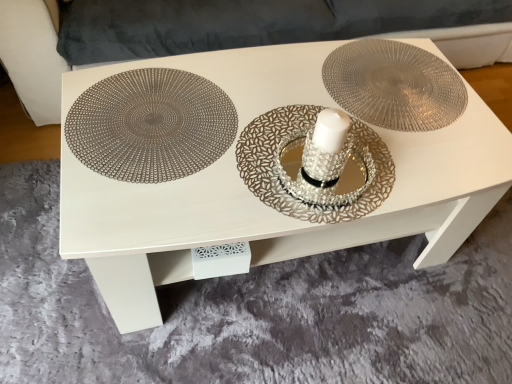
Measure the distance between point [234,228] and camera.

Point [234,228] and camera are 33.90 inches apart.

What is the approximate height of metallic placemat at center?

47.10 centimeters.

Find the location of a particular element. metallic textured saucer at center is located at coordinates (394, 85).

Image resolution: width=512 pixels, height=384 pixels. Describe the element at coordinates (394, 85) in the screenshot. I see `metallic textured saucer at center` at that location.

What do you see at coordinates (313, 165) in the screenshot? I see `silver textured plate at center` at bounding box center [313, 165].

Find the location of `suede-like gray couch at upper center`. suede-like gray couch at upper center is located at coordinates (32, 57).

Is suede-like gray couch at upper center facing away from metallic woven placemat at left?

No, suede-like gray couch at upper center is not facing the opposite direction of metallic woven placemat at left.

Considering the positions of objects suede-like gray couch at upper center and metallic woven placemat at left in the image provided, who is more to the right, suede-like gray couch at upper center or metallic woven placemat at left?

suede-like gray couch at upper center is more to the right.

From the image's perspective, which one is positioned lower, suede-like gray couch at upper center or metallic woven placemat at left?

From the image's view, metallic woven placemat at left is below.

Which is further, (47,82) or (230,144)?

Positioned behind is point (47,82).

From the image's perspective, is metallic textured saucer at center under suede-like gray couch at upper center?

Indeed, from the image's perspective, metallic textured saucer at center is shown beneath suede-like gray couch at upper center.

Is metallic textured saucer at center outside of suede-like gray couch at upper center?

metallic textured saucer at center is positioned outside suede-like gray couch at upper center.

From a real-world perspective, is metallic textured saucer at center beneath suede-like gray couch at upper center?

No, from a real-world perspective, metallic textured saucer at center is not beneath suede-like gray couch at upper center.

Where is `saucer above the suede-like gray couch at upper center (from a real-world perspective)`? The image size is (512, 384). saucer above the suede-like gray couch at upper center (from a real-world perspective) is located at coordinates (394, 85).

Considering the relative sizes of metallic textured saucer at center and metallic woven placemat at left in the image provided, is metallic textured saucer at center wider than metallic woven placemat at left?

No.

The width and height of the screenshot is (512, 384). There is a metallic woven placemat at left. What are the coordinates of `saucer above it (from a real-world perspective)` in the screenshot? It's located at (394, 85).

From the image's perspective, does metallic textured saucer at center appear higher than metallic woven placemat at left?

Yes, from the image's perspective, metallic textured saucer at center is over metallic woven placemat at left.

Could you tell me if silver textured plate at center is turned towards metallic woven placemat at left?

No, silver textured plate at center is not oriented towards metallic woven placemat at left.

Considering the points (324, 207) and (166, 81), which point is in front, point (324, 207) or point (166, 81)?

Point (324, 207)

Measure the distance from silver textured plate at center to metallic woven placemat at left.

silver textured plate at center and metallic woven placemat at left are 8.67 inches apart from each other.

Considering the relative sizes of silver textured plate at center and metallic woven placemat at left in the image provided, is silver textured plate at center smaller than metallic woven placemat at left?

Indeed, silver textured plate at center has a smaller size compared to metallic woven placemat at left.

Could you tell me if metallic woven placemat at left is turned towards metallic placemat at center?

Yes.

Is metallic woven placemat at left not inside metallic placemat at center?

Actually, metallic woven placemat at left is at least partially inside metallic placemat at center.

Looking at their sizes, would you say metallic woven placemat at left is wider or thinner than metallic placemat at center?

metallic woven placemat at left is thinner than metallic placemat at center.

The image size is (512, 384). I want to click on plate below the suede-like gray couch at upper center (from the image's perspective), so click(x=313, y=165).

Are suede-like gray couch at upper center and silver textured plate at center far apart?

Yes, suede-like gray couch at upper center and silver textured plate at center are located far from each other.

From the image's perspective, which is above, suede-like gray couch at upper center or silver textured plate at center?

suede-like gray couch at upper center.

Is the position of metallic placemat at center more distant than that of suede-like gray couch at upper center?

No, metallic placemat at center is closer to the camera.

Is point (173, 257) positioned after point (44, 43)?

That is False.

I want to click on table that appears on the left of suede-like gray couch at upper center, so click(255, 197).

Looking at this image, considering the relative sizes of metallic placemat at center and suede-like gray couch at upper center in the image provided, is metallic placemat at center shorter than suede-like gray couch at upper center?

Yes, metallic placemat at center is shorter than suede-like gray couch at upper center.

At what (x,y) coordinates should I click in order to perform the action: click on place mat located on the left of suede-like gray couch at upper center. Please return your answer as a coordinate pair (x, y). This screenshot has height=384, width=512. Looking at the image, I should click on (151, 125).

Identify the location of saucer lying in front of the suede-like gray couch at upper center. (394, 85).

When comparing their distances from metallic textured saucer at center, does suede-like gray couch at upper center or silver textured plate at center seem further?

suede-like gray couch at upper center is positioned further to the anchor metallic textured saucer at center.

Considering their positions, is suede-like gray couch at upper center positioned closer to metallic woven placemat at left than metallic placemat at center?

Based on the image, metallic placemat at center appears to be nearer to metallic woven placemat at left.

Based on their spatial positions, is metallic woven placemat at left or metallic textured saucer at center further from metallic placemat at center?

metallic textured saucer at center lies further to metallic placemat at center than the other object.

When comparing their distances from metallic woven placemat at left, does silver textured plate at center or suede-like gray couch at upper center seem further?

suede-like gray couch at upper center.

From the image, which object appears to be nearer to metallic textured saucer at center, metallic placemat at center or metallic woven placemat at left?

metallic placemat at center is closer to metallic textured saucer at center.

Looking at this image, looking at the image, which one is located further to silver textured plate at center, metallic textured saucer at center or metallic woven placemat at left?

The object further to silver textured plate at center is metallic textured saucer at center.

Looking at the image, which one is located further to metallic placemat at center, metallic woven placemat at left or suede-like gray couch at upper center?

The object further to metallic placemat at center is suede-like gray couch at upper center.

Which object lies nearer to the anchor point metallic textured saucer at center, silver textured plate at center or metallic placemat at center?

The object closer to metallic textured saucer at center is metallic placemat at center.

Locate an element on the screen. The image size is (512, 384). plate between metallic woven placemat at left and metallic textured saucer at center is located at coordinates (313, 165).

Where is `place mat between suede-like gray couch at upper center and metallic placemat at center from top to bottom`? The image size is (512, 384). place mat between suede-like gray couch at upper center and metallic placemat at center from top to bottom is located at coordinates (151, 125).

This screenshot has height=384, width=512. I want to click on table between metallic woven placemat at left and metallic textured saucer at center, so click(255, 197).

This screenshot has width=512, height=384. I want to click on place mat between suede-like gray couch at upper center and silver textured plate at center in the up-down direction, so click(x=151, y=125).